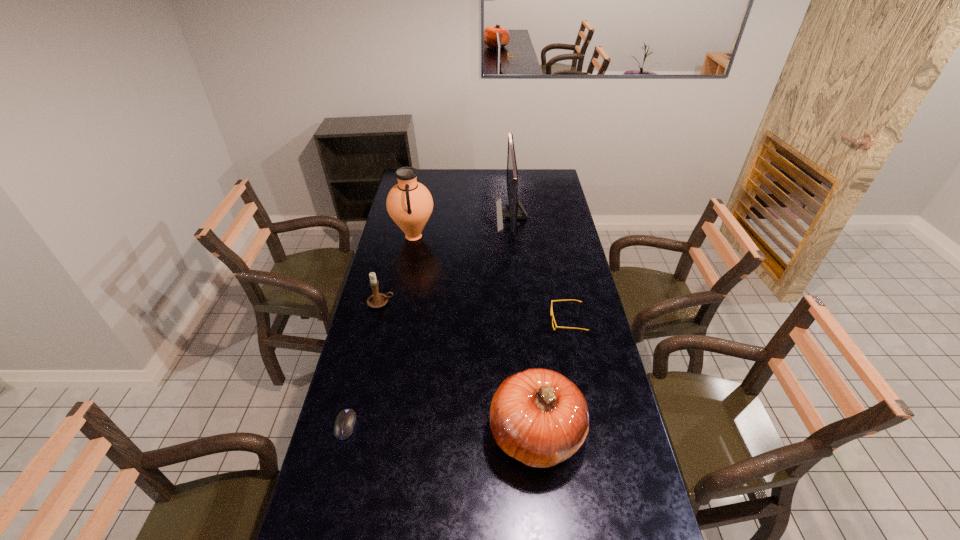
Locate an element on the screen. The width and height of the screenshot is (960, 540). vacant area between the pitcher and the computer mouse is located at coordinates (380, 331).

This screenshot has width=960, height=540. What are the coordinates of `free area in between the monitor and the third tallest object` in the screenshot? It's located at (524, 326).

The height and width of the screenshot is (540, 960). Find the location of `free spot between the computer mouse and the spectacles`. free spot between the computer mouse and the spectacles is located at coordinates (457, 373).

You are a GUI agent. You are given a task and a screenshot of the screen. Output one action in this format:
    pyautogui.click(x=<x>, y=<y>)
    Task: Click on the vacant space in between the candle holder and the monitor
    
    Given the screenshot: What is the action you would take?
    pyautogui.click(x=446, y=259)

The height and width of the screenshot is (540, 960). I want to click on object that stands as the second closest to the fifth tallest object, so click(513, 214).

Identify which object is the second closest to the third tallest object. Please provide its 2D coordinates. Your answer should be formatted as a tuple, i.e. [(x, y)], where the tuple contains the x and y coordinates of a point satisfying the conditions above.

[(345, 421)]

Where is `vacant area that satisfies the following two spatial constraints: 1. on the screen side of the monitor; 2. on the back side of the pumpkin`? The width and height of the screenshot is (960, 540). vacant area that satisfies the following two spatial constraints: 1. on the screen side of the monitor; 2. on the back side of the pumpkin is located at coordinates (534, 435).

This screenshot has height=540, width=960. What are the coordinates of `free point that satisfies the following two spatial constraints: 1. on the front side of the fourth shortest object; 2. on the left side of the shortest object` in the screenshot? It's located at (344, 435).